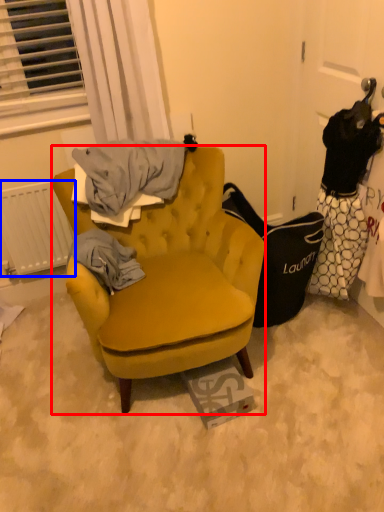
Question: Which object appears farthest to the camera in this image, chair (highlighted by a red box) or radiator (highlighted by a blue box)?

Choices:
 (A) chair
 (B) radiator

Answer: (B)